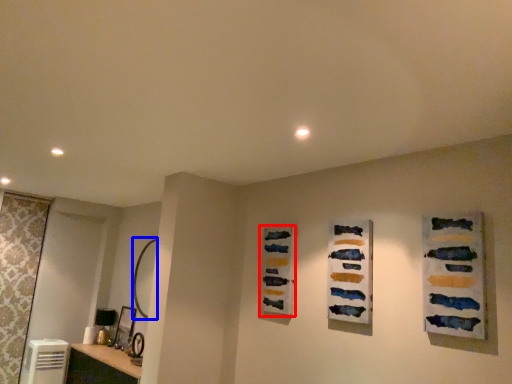
Question: Among these objects, which one is nearest to the camera, art (highlighted by a red box) or mirror (highlighted by a blue box)?

Choices:
 (A) art
 (B) mirror

Answer: (A)